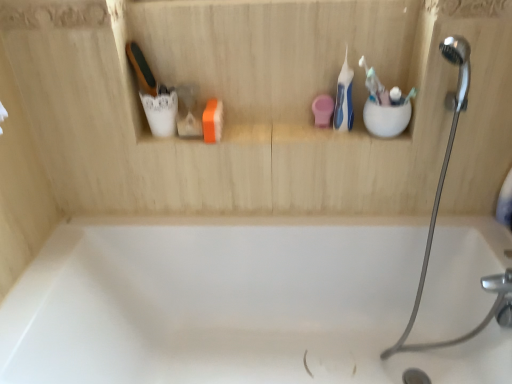
Question: Would you say white plastic toothbrush at upper right, the second toothbrush when ordered from right to left, is inside or outside blue plastic toothbrush at upper right, the 1th toothbrush from the left?

Choices:
 (A) inside
 (B) outside

Answer: (B)

Question: From the image's perspective, is white plastic toothbrush at upper right, the second toothbrush when ordered from right to left, positioned above or below blue plastic toothbrush at upper right, arranged as the 3th toothbrush when viewed from the right?

Choices:
 (A) below
 (B) above

Answer: (A)

Question: Which object is positioned farthest from the white plastic toothbrush at upper right, which is counted as the second toothbrush, starting from the left?

Choices:
 (A) white plastic toothbrush at upper right, which is counted as the 1th toothbrush, starting from the right
 (B) blue plastic toothbrush at upper right, the 1th toothbrush from the left
 (C) silver metallic shower head at upper right
 (D) white glossy bathtub at center

Answer: (D)

Question: Which object is the farthest from the white glossy bathtub at center?

Choices:
 (A) white plastic toothbrush at upper right, which is counted as the second toothbrush, starting from the left
 (B) blue plastic toothbrush at upper right, the 1th toothbrush from the left
 (C) silver metallic shower head at upper right
 (D) white plastic toothbrush at upper right, which is counted as the 1th toothbrush, starting from the right

Answer: (D)